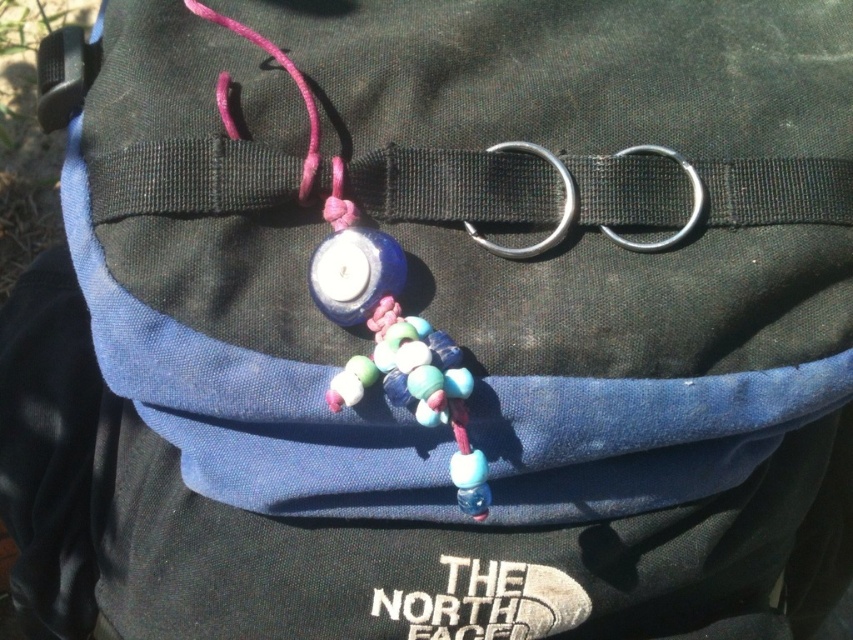
Looking at this image, you are trying to attach a keychain to your backpack strap. You have two options, one is to place it on the black fabric strap at center and the other is to place it on the matte blue bead at center. Which object is on the left side where you can attach it?

The matte blue bead at center is on the left side of the black fabric strap at center, so you can attach the keychain there.

You are a hiker who just found a backpack with a black fabric strap at center and a matte blue bead at center attached to it. You want to know if the bead is visible from the front. Based on the scene description, can you determine if the bead is visible?

The black fabric strap at center is positioned over matte blue bead at center, so the bead is partially or fully hidden by the strap and may not be visible from the front.